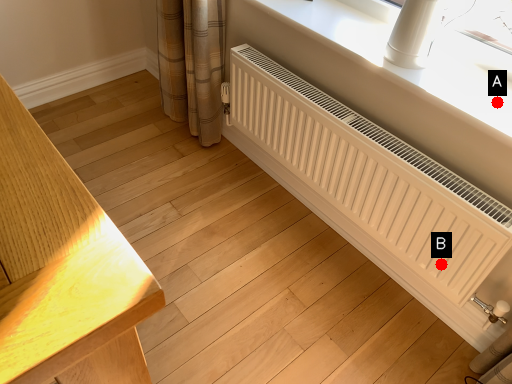
Question: Two points are circled on the image, labeled by A and B beside each circle. Which point is closer to the camera taking this photo?

Choices:
 (A) A is closer
 (B) B is closer

Answer: (A)